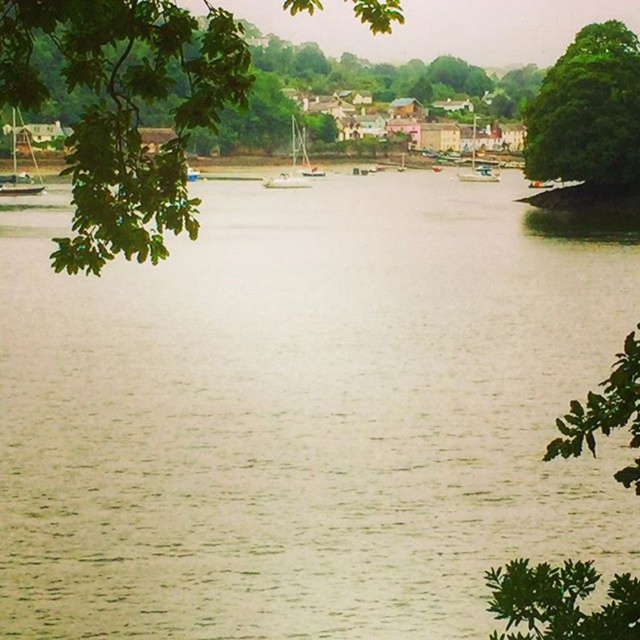
You are standing at the riverside and want to take a photo of the green leafy tree at upper left and the wooden sailboat at left. Which object is positioned to the right side of the other?

The green leafy tree at upper left is positioned to the right of wooden sailboat at left.

You are standing at the point with coordinates point (x=294, y=154) and want to walk towards the point with coordinates point (x=410, y=584). Which direction should you move relative to your current position?

You should move forward because point (x=410, y=584) is in front of point (x=294, y=154).

You are standing on the riverside path and see the brown water at center and the white glossy sailboat at center. Which object is closer to you?

The brown water at center is closer to you because it is in front of the white glossy sailboat at center.